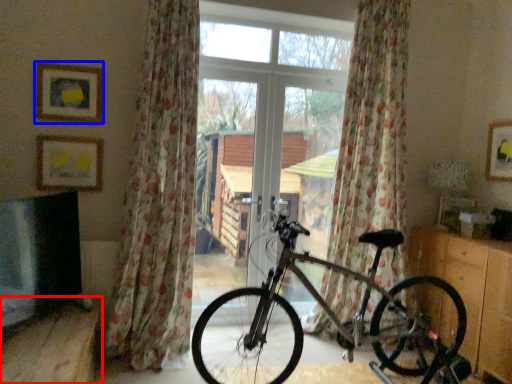
Question: Among these objects, which one is farthest to the camera, furniture (highlighted by a red box) or picture frame (highlighted by a blue box)?

Choices:
 (A) furniture
 (B) picture frame

Answer: (B)